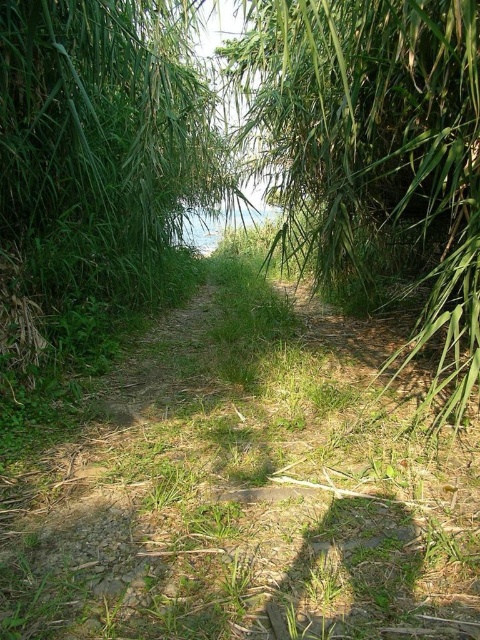
Describe the element at coordinates (240, 497) in the screenshot. I see `green grass at center` at that location.

Where is `green grass at center`? This screenshot has height=640, width=480. green grass at center is located at coordinates (240, 497).